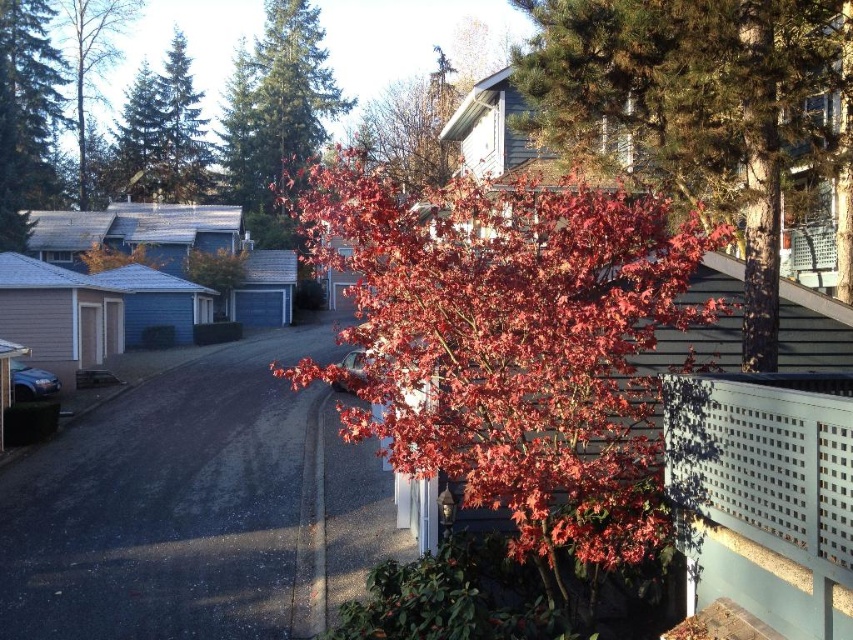
Question: Estimate the real-world distances between objects in this image. Which object is farther from the smooth bark tree at upper left?

Choices:
 (A) shiny red maple at center
 (B) green textured pine tree at upper left
 (C) dark asphalt driveway at lower left

Answer: (C)

Question: Is dark asphalt driveway at lower left above shiny red leaves at center?

Choices:
 (A) yes
 (B) no

Answer: (B)

Question: Can you confirm if dark asphalt driveway at lower left is smaller than smooth bark tree at upper left?

Choices:
 (A) yes
 (B) no

Answer: (A)

Question: Does shiny red maple at center have a smaller size compared to dark asphalt driveway at lower left?

Choices:
 (A) yes
 (B) no

Answer: (B)

Question: Which of these objects is positioned farthest from the green textured pine tree at upper left?

Choices:
 (A) shiny green pine tree at upper left
 (B) shiny red leaves at center
 (C) shiny red maple at center
 (D) smooth bark tree at upper left

Answer: (B)

Question: Among these objects, which one is nearest to the camera?

Choices:
 (A) shiny red maple at center
 (B) green textured pine tree at upper left
 (C) dark asphalt driveway at lower left

Answer: (A)